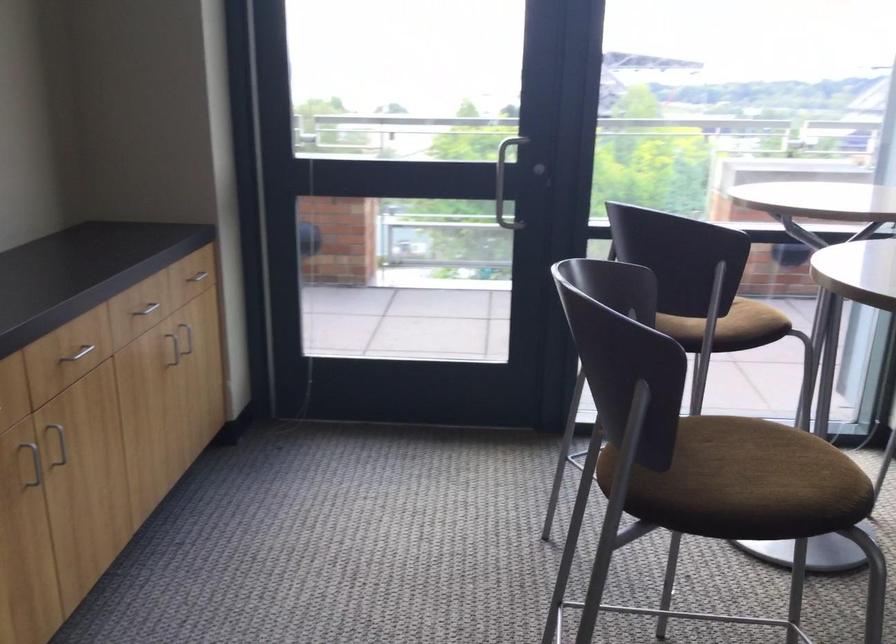
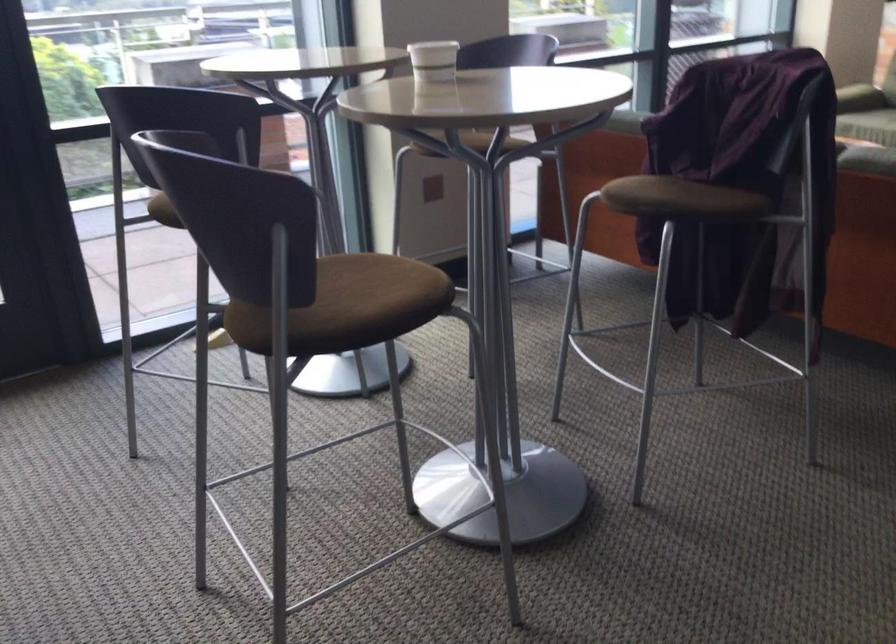
Question: The camera is either moving clockwise (left) or counter-clockwise (right) around the object. The first image is from the beginning of the video and the second image is from the end. Is the camera moving left or right when shooting the video?

Choices:
 (A) Left
 (B) Right

Answer: (A)